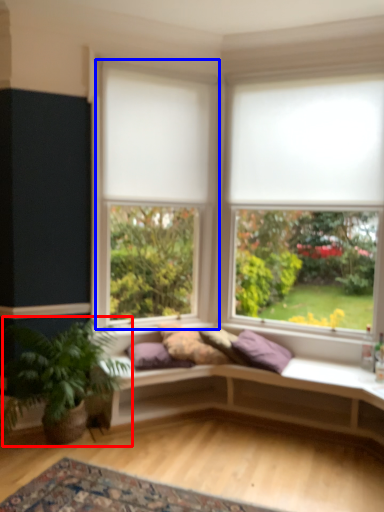
Question: Among these objects, which one is farthest to the camera, houseplant (highlighted by a red box) or window (highlighted by a blue box)?

Choices:
 (A) houseplant
 (B) window

Answer: (B)